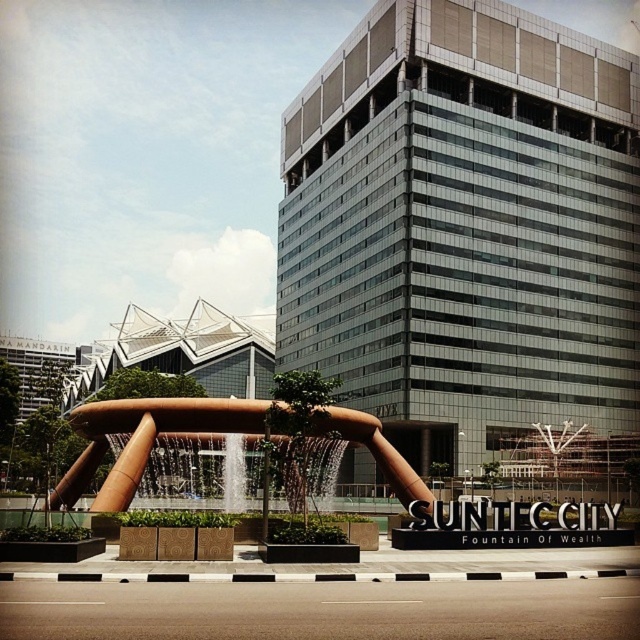
You are standing at the entrance of the building and want to take a photo of the gold metallic sculpture at center. Which direction should you walk to get closer to it?

The gold metallic sculpture at center is located at point (145, 440) in the image, so you should walk towards the center of the image to get closer to it.

You are standing at point A located at coordinates point A at (144, 452). You need to walk to point B which is 132.24 feet away from you. Are you able to walk directly to point B without any obstacles?

The distance between point A at (144, 452) and point B is 132.24 feet. Since the scene shows an open area around the fountain and the building, there are no mentioned obstacles, so you can walk directly to point B.

You are standing at the entrance of the building and want to walk towards the clear glass water at center. Which direction should you turn to first see the gold metallic sculpture at center?

The gold metallic sculpture at center is to the left of clear glass water at center, so you should turn left to see it first.